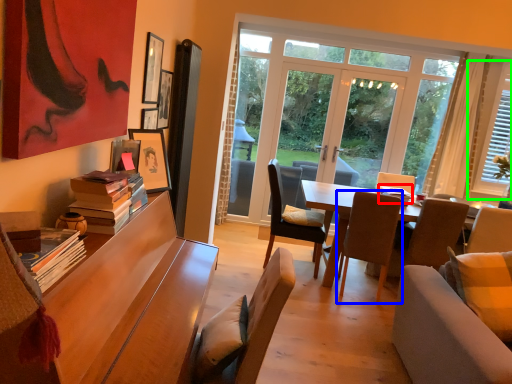
Question: Which object is positioned closest to book (highlighted by a red box)? Select from chair (highlighted by a blue box) and window (highlighted by a green box).

Choices:
 (A) chair
 (B) window

Answer: (A)